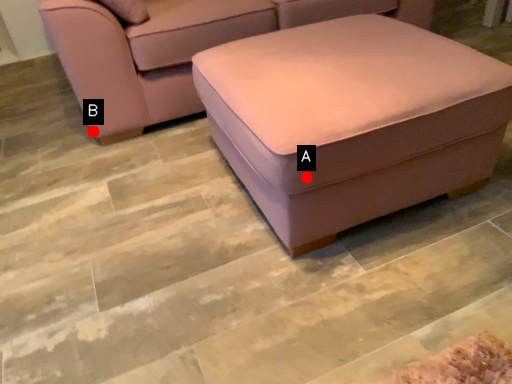
Question: Two points are circled on the image, labeled by A and B beside each circle. Which of the following is the farthest from the observer?

Choices:
 (A) A is further
 (B) B is further

Answer: (B)